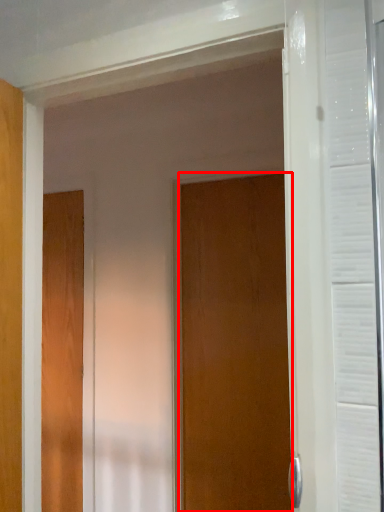
Question: Where is door (annotated by the red box) located in relation to door in the image?

Choices:
 (A) right
 (B) left

Answer: (A)